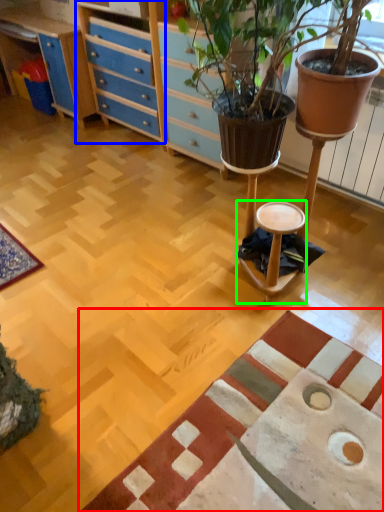
Question: Considering the real-world distances, which object is farthest from mat (highlighted by a red box)? file cabinet (highlighted by a blue box) or stool (highlighted by a green box)?

Choices:
 (A) file cabinet
 (B) stool

Answer: (A)